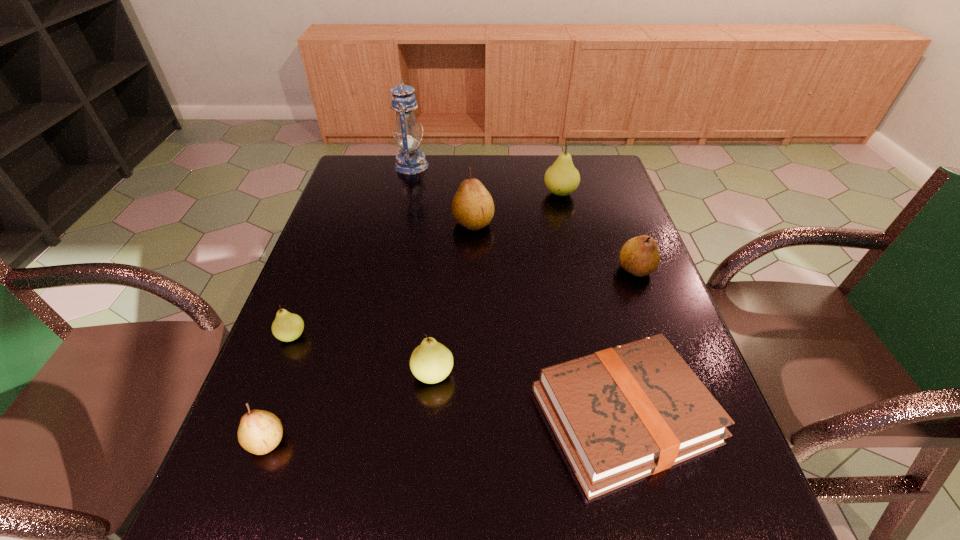
Locate an element on the screen. The height and width of the screenshot is (540, 960). the sixth object from right to left is located at coordinates (410, 161).

The height and width of the screenshot is (540, 960). I want to click on lantern, so click(410, 161).

Locate an element on the screen. Image resolution: width=960 pixels, height=540 pixels. the fifth pear from left to right is located at coordinates (562, 178).

At what (x,y) coordinates should I click in order to perform the action: click on the rightmost green pear. Please return your answer as a coordinate pair (x, y). Looking at the image, I should click on (562, 178).

This screenshot has height=540, width=960. In order to click on the second brown pear from right to left in this screenshot , I will do `click(472, 207)`.

Locate an element on the screen. Image resolution: width=960 pixels, height=540 pixels. the fifth nearest pear is located at coordinates coord(472,207).

The height and width of the screenshot is (540, 960). Identify the location of the second biggest brown pear. (640, 256).

Identify the location of the second nearest brown pear. This screenshot has width=960, height=540. (640, 256).

You are a GUI agent. You are given a task and a screenshot of the screen. Output one action in this format:
    pyautogui.click(x=<x>, y=<y>)
    Task: Click on the nearest green pear
    
    Given the screenshot: What is the action you would take?
    pyautogui.click(x=431, y=362)

Locate an element on the screen. the second biggest green pear is located at coordinates (431, 362).